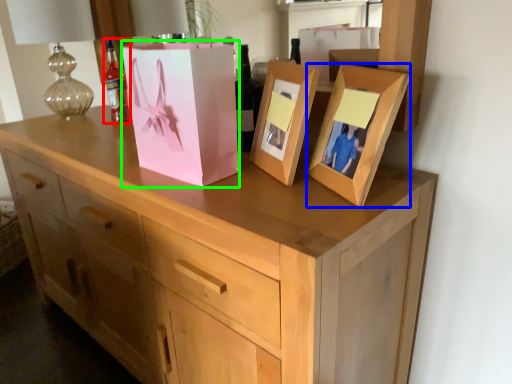
Question: Estimate the real-world distances between objects in this image. Which object is closer to bottle (highlighted by a red box), picture frame (highlighted by a blue box) or cardboard box (highlighted by a green box)?

Choices:
 (A) picture frame
 (B) cardboard box

Answer: (B)